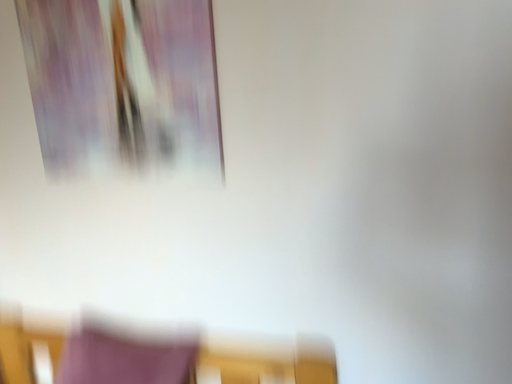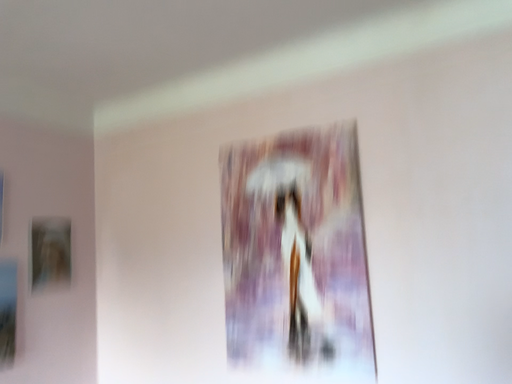
Question: How did the camera likely rotate when shooting the video?

Choices:
 (A) rotated downward
 (B) rotated upward

Answer: (B)